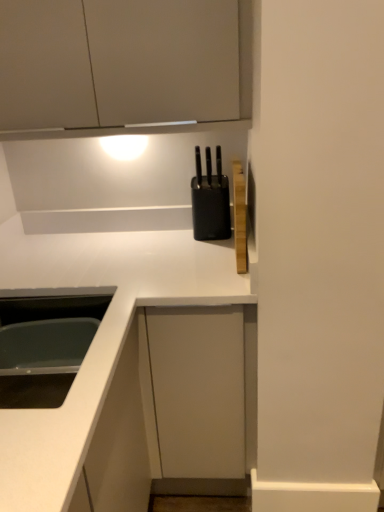
Question: Should I look upward or downward to see white glossy sink at lower left?

Choices:
 (A) up
 (B) down

Answer: (B)

Question: From the image's perspective, is white glossy countertop at center located above white glossy sink at lower left?

Choices:
 (A) no
 (B) yes

Answer: (A)

Question: Considering the relative positions of white glossy countertop at center and white glossy sink at lower left in the image provided, is white glossy countertop at center to the left of white glossy sink at lower left from the viewer's perspective?

Choices:
 (A) yes
 (B) no

Answer: (B)

Question: Does white glossy countertop at center have a larger size compared to white glossy sink at lower left?

Choices:
 (A) no
 (B) yes

Answer: (B)

Question: From the image's perspective, is white glossy countertop at center located beneath white glossy sink at lower left?

Choices:
 (A) yes
 (B) no

Answer: (A)

Question: Could you tell me if white glossy countertop at center is turned towards white glossy sink at lower left?

Choices:
 (A) no
 (B) yes

Answer: (B)

Question: Is white glossy countertop at center not near white glossy sink at lower left?

Choices:
 (A) yes
 (B) no

Answer: (B)

Question: Is white glossy sink at lower left next to white glossy countertop at center and touching it?

Choices:
 (A) yes
 (B) no

Answer: (B)

Question: Is white glossy sink at lower left turned away from white glossy countertop at center?

Choices:
 (A) no
 (B) yes

Answer: (A)

Question: Considering the relative sizes of white glossy sink at lower left and white glossy countertop at center in the image provided, is white glossy sink at lower left wider than white glossy countertop at center?

Choices:
 (A) yes
 (B) no

Answer: (B)

Question: Is white glossy sink at lower left aimed at white glossy countertop at center?

Choices:
 (A) yes
 (B) no

Answer: (B)

Question: From a real-world perspective, is white glossy sink at lower left positioned over white glossy countertop at center based on gravity?

Choices:
 (A) no
 (B) yes

Answer: (B)

Question: From the image's perspective, is white glossy sink at lower left beneath white glossy countertop at center?

Choices:
 (A) no
 (B) yes

Answer: (A)

Question: Can you confirm if white glossy sink at lower left is shorter than black plastic knife block at upper center?

Choices:
 (A) yes
 (B) no

Answer: (A)